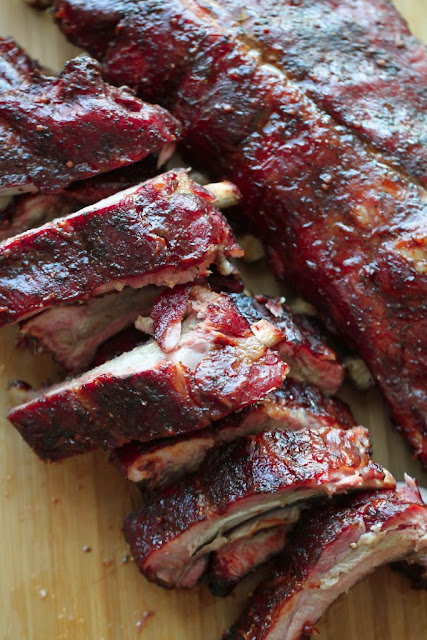
This screenshot has width=427, height=640. I want to click on cutting board, so click(26, 540), click(43, 45), click(415, 17).